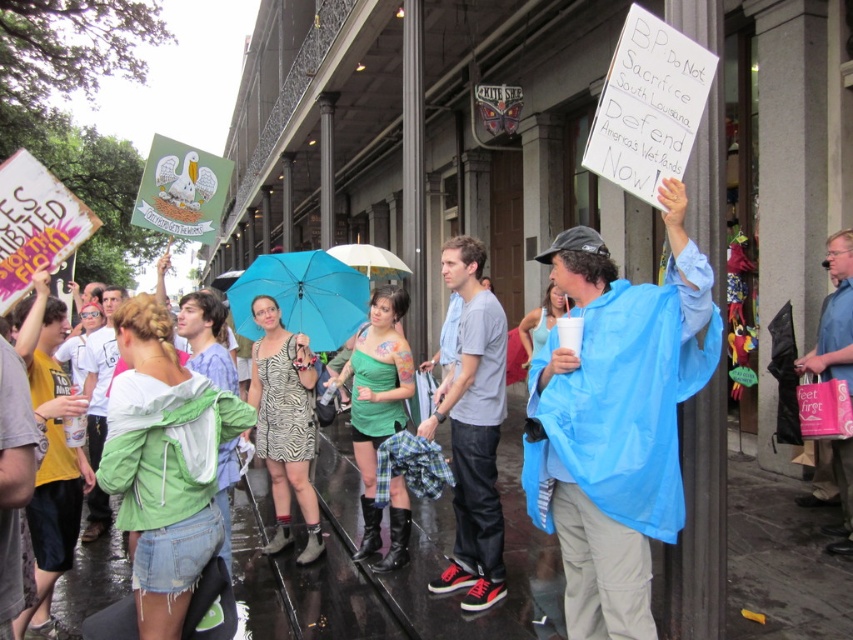
Who is positioned more to the right, zebra print dress at center or green matte dress at center?

green matte dress at center

Can you confirm if zebra print dress at center is smaller than green matte dress at center?

Indeed, zebra print dress at center has a smaller size compared to green matte dress at center.

Who is more forward, [283,408] or [352,557]?

Point [283,408] is more forward.

Identify the location of zebra print dress at center. The image size is (853, 640). (285, 424).

Identify the location of green denim jacket at lower left. This screenshot has width=853, height=640. (164, 465).

What do you see at coordinates (164, 465) in the screenshot?
I see `green denim jacket at lower left` at bounding box center [164, 465].

Which is in front, point (169, 436) or point (267, 305)?

Point (169, 436) is more forward.

Identify the location of green denim jacket at lower left. (164, 465).

This screenshot has height=640, width=853. What are the coordinates of `green denim jacket at lower left` in the screenshot? It's located at click(164, 465).

The width and height of the screenshot is (853, 640). What are the coordinates of `green denim jacket at lower left` in the screenshot? It's located at tap(164, 465).